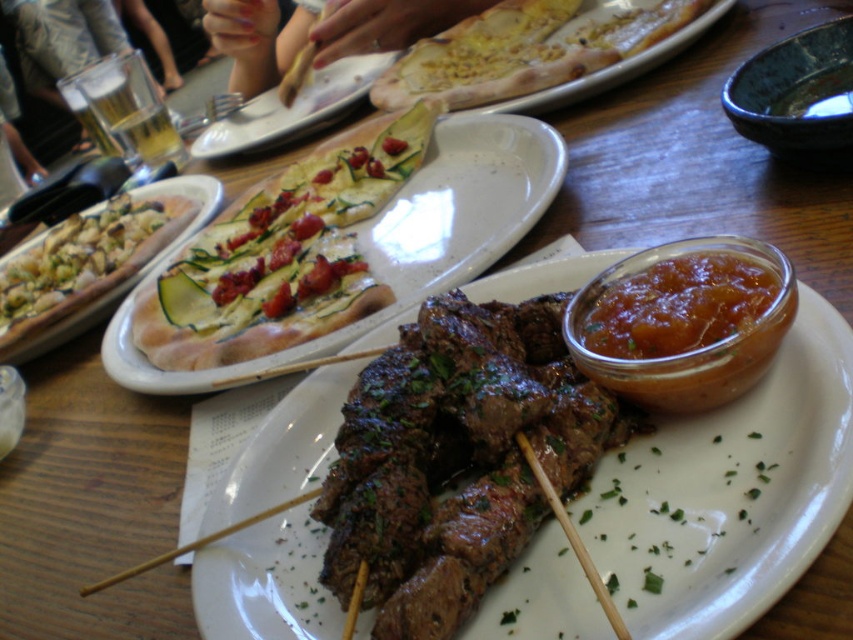
Does white ceramic platter at upper center appear on the left side of matte ceramic plate at upper center?

Incorrect, white ceramic platter at upper center is not on the left side of matte ceramic plate at upper center.

I want to click on white ceramic platter at upper center, so point(404,237).

Find the location of a particular element. This screenshot has height=640, width=853. white ceramic platter at upper center is located at coordinates (404, 237).

Between shiny amber jam at center right and green zucchini pizza at left, which one appears on the right side from the viewer's perspective?

From the viewer's perspective, shiny amber jam at center right appears more on the right side.

Does shiny amber jam at center right have a greater height compared to green zucchini pizza at left?

No.

Is point (708, 388) positioned after point (184, 220)?

No, it is not.

Where is `shiny amber jam at center right`? This screenshot has height=640, width=853. shiny amber jam at center right is located at coordinates (685, 332).

Looking at this image, who is taller, white ceramic platter at upper center or green zucchini pizza at left?

white ceramic platter at upper center is taller.

Who is more forward, (488,115) or (65,289)?

Point (488,115)

Where is `white ceramic platter at upper center`? The width and height of the screenshot is (853, 640). white ceramic platter at upper center is located at coordinates (404, 237).